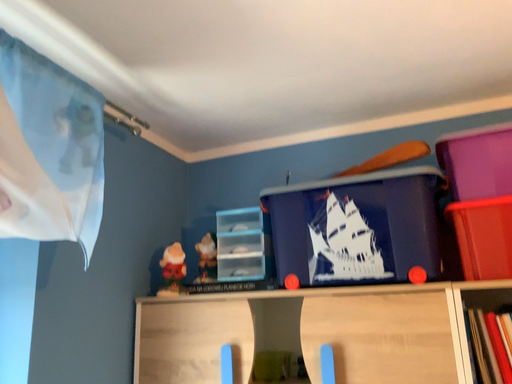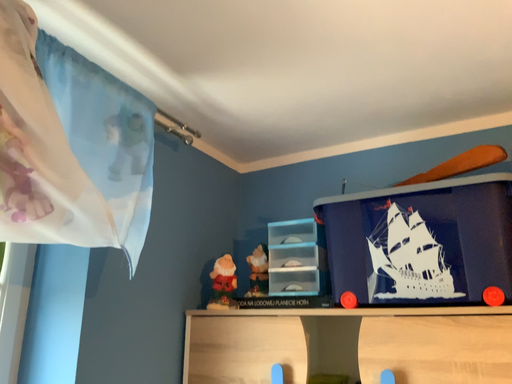
Question: Which way did the camera rotate in the video?

Choices:
 (A) rotated right
 (B) rotated left

Answer: (B)